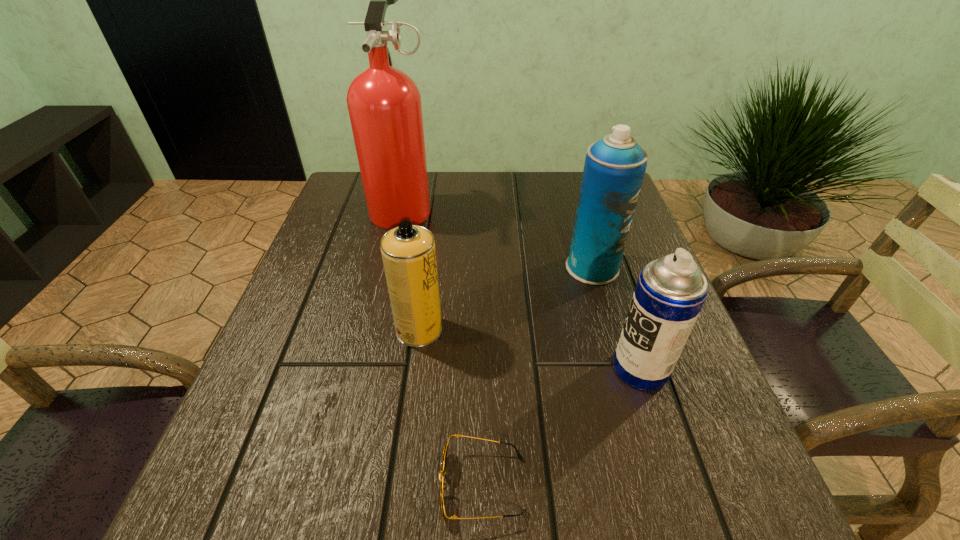
This screenshot has width=960, height=540. I want to click on vacant point at the near right corner, so 726,532.

The height and width of the screenshot is (540, 960). In order to click on free space between the fourth shortest object and the fire extinguisher in this screenshot , I will do `click(497, 237)`.

You are a GUI agent. You are given a task and a screenshot of the screen. Output one action in this format:
    pyautogui.click(x=<x>, y=<y>)
    Task: Click on the free space between the fire extinguisher and the farthest aerosol can
    This screenshot has height=540, width=960.
    Given the screenshot: What is the action you would take?
    pyautogui.click(x=497, y=237)

At what (x,y) coordinates should I click in order to perform the action: click on empty space between the shortest object and the farthest aerosol can. Please return your answer as a coordinate pair (x, y). Looking at the image, I should click on (538, 376).

The width and height of the screenshot is (960, 540). What are the coordinates of `free spot between the third object from left to right and the fourth shortest object` in the screenshot? It's located at (538, 376).

The width and height of the screenshot is (960, 540). What are the coordinates of `unoccupied area between the leftmost aerosol can and the nearest object` in the screenshot? It's located at (451, 407).

You are a GUI agent. You are given a task and a screenshot of the screen. Output one action in this format:
    pyautogui.click(x=<x>, y=<y>)
    Task: Click on the vacant region between the leftmost aerosol can and the fourth shortest object
    
    Given the screenshot: What is the action you would take?
    pyautogui.click(x=506, y=299)

What are the coordinates of `vacant area that lies between the leftmost aerosol can and the shortest object` in the screenshot? It's located at (451, 407).

The height and width of the screenshot is (540, 960). I want to click on the third closest object relative to the farthest object, so click(x=670, y=292).

Find the location of a particular element. the third closest object to the shortest object is located at coordinates (614, 168).